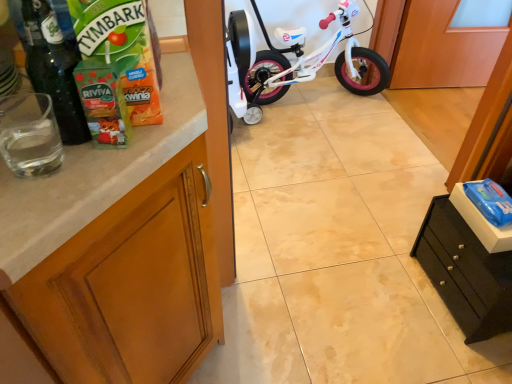
Question: Does black matte drawer at lower right, the first cabinetry positioned from the right, appear on the right side of wooden cabinet at left, which is the second cabinetry in right-to-left order?

Choices:
 (A) yes
 (B) no

Answer: (A)

Question: From a real-world perspective, is black matte drawer at lower right, positioned as the second cabinetry in left-to-right order, located beneath wooden cabinet at left, which is the second cabinetry in right-to-left order?

Choices:
 (A) no
 (B) yes

Answer: (B)

Question: Is black matte drawer at lower right, positioned as the second cabinetry in left-to-right order, shorter than wooden cabinet at left, marked as the first cabinetry in a left-to-right arrangement?

Choices:
 (A) yes
 (B) no

Answer: (A)

Question: Can you confirm if black matte drawer at lower right, the first cabinetry positioned from the right, is taller than wooden cabinet at left, which is the second cabinetry in right-to-left order?

Choices:
 (A) no
 (B) yes

Answer: (A)

Question: Does black matte drawer at lower right, positioned as the second cabinetry in left-to-right order, have a larger size compared to wooden cabinet at left, marked as the first cabinetry in a left-to-right arrangement?

Choices:
 (A) yes
 (B) no

Answer: (B)

Question: Looking at the image, does black matte drawer at lower right, positioned as the second cabinetry in left-to-right order, seem bigger or smaller compared to wooden cabinet at left, which is the second cabinetry in right-to-left order?

Choices:
 (A) small
 (B) big

Answer: (A)

Question: Is black matte drawer at lower right, positioned as the second cabinetry in left-to-right order, in front of or behind wooden cabinet at left, which is the second cabinetry in right-to-left order, in the image?

Choices:
 (A) front
 (B) behind

Answer: (B)

Question: From a real-world perspective, is black matte drawer at lower right, the first cabinetry positioned from the right, above or below wooden cabinet at left, which is the second cabinetry in right-to-left order?

Choices:
 (A) above
 (B) below

Answer: (B)

Question: In the image, is black matte drawer at lower right, positioned as the second cabinetry in left-to-right order, on the left side or the right side of wooden cabinet at left, which is the second cabinetry in right-to-left order?

Choices:
 (A) right
 (B) left

Answer: (A)

Question: Considering their positions, is white glossy bicycle at center located in front of or behind black matte drawer at lower right, positioned as the second cabinetry in left-to-right order?

Choices:
 (A) front
 (B) behind

Answer: (B)

Question: From the image's perspective, is white glossy bicycle at center located above or below black matte drawer at lower right, positioned as the second cabinetry in left-to-right order?

Choices:
 (A) below
 (B) above

Answer: (B)

Question: From their relative heights in the image, would you say white glossy bicycle at center is taller or shorter than black matte drawer at lower right, positioned as the second cabinetry in left-to-right order?

Choices:
 (A) tall
 (B) short

Answer: (A)

Question: Looking at their shapes, would you say white glossy bicycle at center is wider or thinner than black matte drawer at lower right, the first cabinetry positioned from the right?

Choices:
 (A) thin
 (B) wide

Answer: (B)

Question: Is wooden cabinet at left, which is the second cabinetry in right-to-left order, inside or outside of black matte drawer at lower right, the first cabinetry positioned from the right?

Choices:
 (A) outside
 (B) inside

Answer: (A)

Question: Based on their positions, is wooden cabinet at left, which is the second cabinetry in right-to-left order, located to the left or right of black matte drawer at lower right, the first cabinetry positioned from the right?

Choices:
 (A) right
 (B) left

Answer: (B)